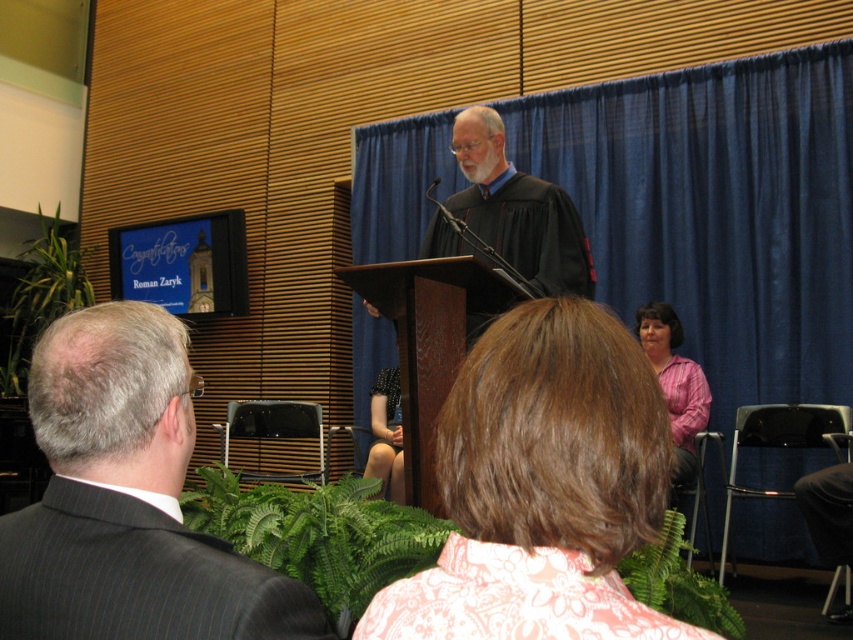
Question: Among these points, which one is nearest to the camera?

Choices:
 (A) (671, 426)
 (B) (496, 584)

Answer: (B)

Question: Among these objects, which one is farthest from the camera?

Choices:
 (A) pink shirt at lower right
 (B) light brown hair at center
 (C) black pinstripe suit at left
 (D) blue fabric curtain at upper center

Answer: (D)

Question: Is light brown hair at center thinner than pink floral blouse at center?

Choices:
 (A) no
 (B) yes

Answer: (A)

Question: Based on their relative distances, which object is nearer to the black pinstripe suit at left?

Choices:
 (A) black pinstripe suit at lower left
 (B) pink shirt at lower right

Answer: (A)

Question: Can you confirm if blue fabric curtain at upper center is positioned below pink floral blouse at center?

Choices:
 (A) yes
 (B) no

Answer: (B)

Question: Where is blue fabric curtain at upper center located in relation to black pinstripe suit at lower left in the image?

Choices:
 (A) above
 (B) below

Answer: (A)